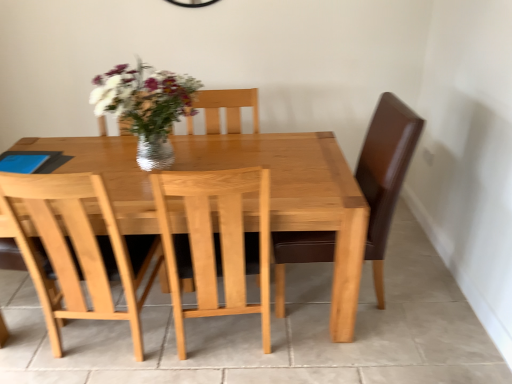
Question: Is shiny silver vase at center inside light brown wooden table at center?

Choices:
 (A) no
 (B) yes

Answer: (A)

Question: Is light brown wooden table at center closer to camera compared to shiny silver vase at center?

Choices:
 (A) no
 (B) yes

Answer: (A)

Question: Is light brown wooden table at center not inside shiny silver vase at center?

Choices:
 (A) no
 (B) yes

Answer: (B)

Question: Can you confirm if light brown wooden table at center is shorter than shiny silver vase at center?

Choices:
 (A) yes
 (B) no

Answer: (B)

Question: Considering the relative positions of light brown wooden table at center and shiny silver vase at center in the image provided, is light brown wooden table at center to the left of shiny silver vase at center from the viewer's perspective?

Choices:
 (A) no
 (B) yes

Answer: (A)

Question: Does light brown wooden table at center have a greater width compared to shiny silver vase at center?

Choices:
 (A) no
 (B) yes

Answer: (B)

Question: From the image's perspective, is shiny silver vase at center on top of light brown wooden table at center?

Choices:
 (A) yes
 (B) no

Answer: (A)

Question: From a real-world perspective, is shiny silver vase at center physically above light brown wooden table at center?

Choices:
 (A) yes
 (B) no

Answer: (A)

Question: Considering the relative sizes of shiny silver vase at center and light brown wooden table at center in the image provided, is shiny silver vase at center smaller than light brown wooden table at center?

Choices:
 (A) yes
 (B) no

Answer: (A)

Question: Is shiny silver vase at center not within light brown wooden table at center?

Choices:
 (A) yes
 (B) no

Answer: (A)

Question: Is shiny silver vase at center positioned far away from light brown wooden table at center?

Choices:
 (A) yes
 (B) no

Answer: (B)

Question: Considering the relative sizes of shiny silver vase at center and light brown wooden table at center in the image provided, is shiny silver vase at center thinner than light brown wooden table at center?

Choices:
 (A) yes
 (B) no

Answer: (A)

Question: Is light wood chair at center placed right next to light brown wooden table at center?

Choices:
 (A) yes
 (B) no

Answer: (B)